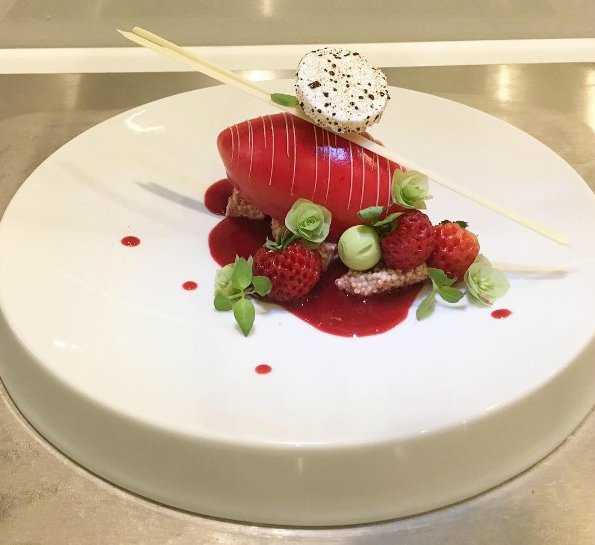
Find the location of `green plants`. green plants is located at coordinates (241, 296), (309, 217), (358, 245), (412, 191), (436, 284), (481, 284).